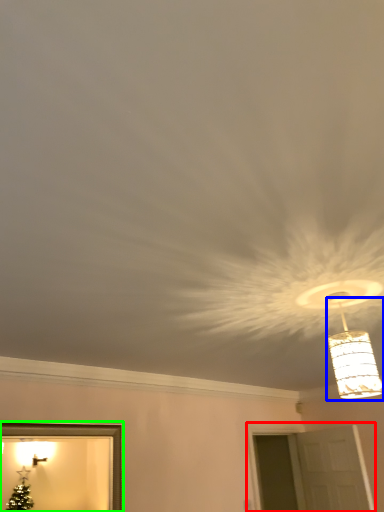
Question: Estimate the real-world distances between objects in this image. Which object is farther from window (highlighted by a red box), lamp (highlighted by a blue box) or picture frame (highlighted by a green box)?

Choices:
 (A) lamp
 (B) picture frame

Answer: (A)